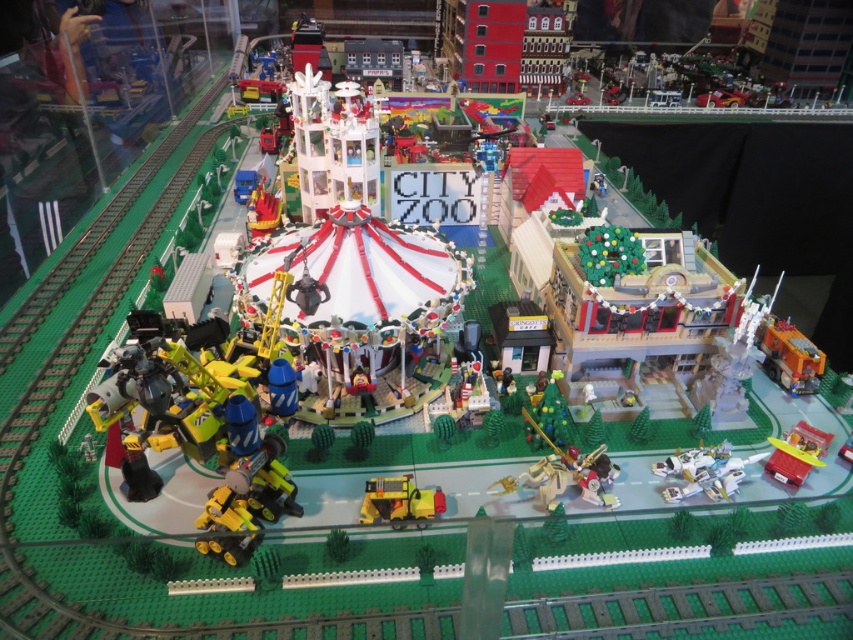
You are a visitor at the LEGO city zoo and want to take a photo of the white plastic airplane at lower right and the yellow matte truck at center. Which object should you focus on first to ensure it appears larger in your photo?

The white plastic airplane at lower right is closer to the viewer than the yellow matte truck at center, so focusing on it first will make it appear larger in the photo.

You are a LEGO figure standing at the edge of the zoo area and want to place a new LEGO tree between the gold metallic horse at center and the translucent yellow airplane at lower right. The tree requires 12 inches of space to fit. Can you fit the tree between them?

The gold metallic horse at center and the translucent yellow airplane at lower right are 13.08 inches apart from each other. Since the tree requires 12 inches of space, there is enough room to fit the tree between them.

You are a visitor at the LEGO city zoo and want to take a photo of both the yellow matte truck at center and the translucent yellow airplane at lower right. Which object will appear larger in your photo?

The yellow matte truck at center will appear larger in the photo because it is closer to the viewer than the translucent yellow airplane at lower right.